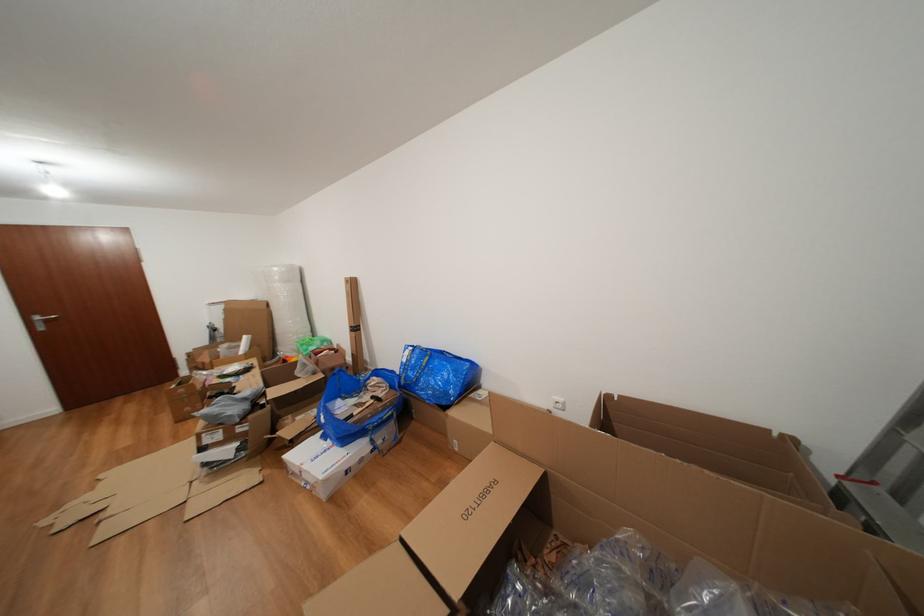
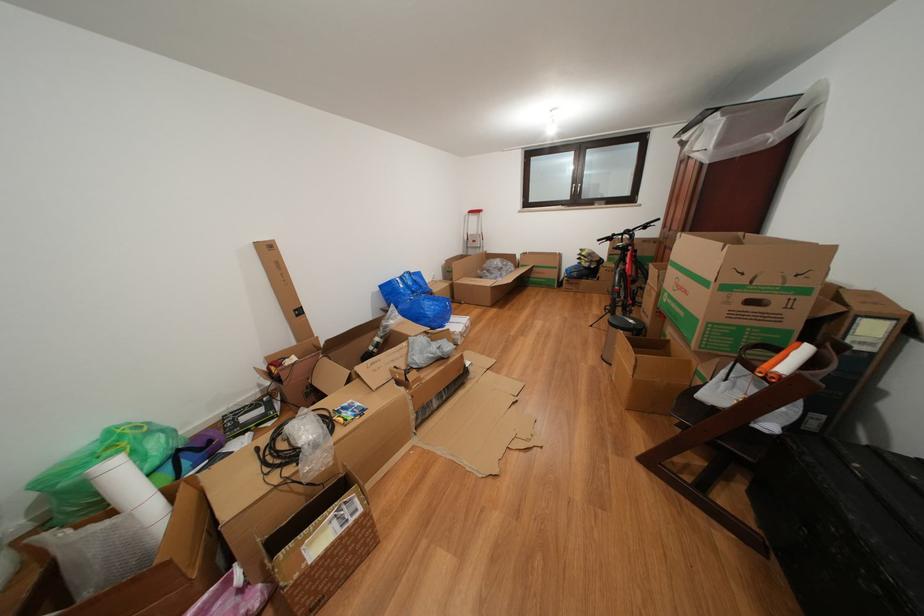
Locate, in the second image, the point that corresponds to (x=412, y=365) in the first image.

(409, 291)